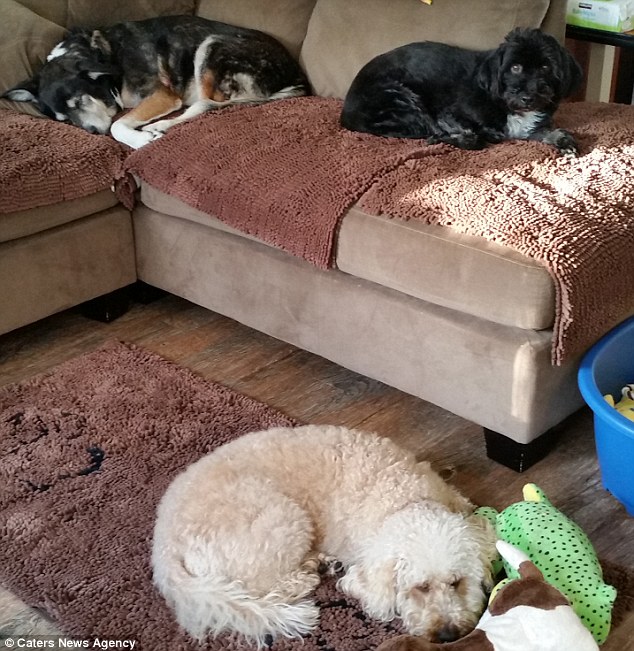
Image resolution: width=634 pixels, height=651 pixels. What are the coordinates of `wood floor` in the screenshot? It's located at (340, 398).